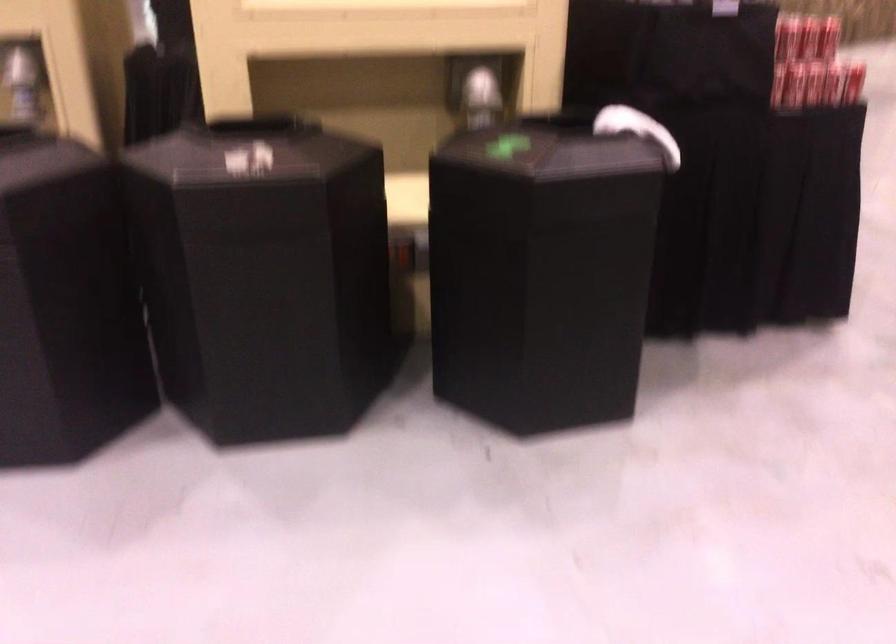
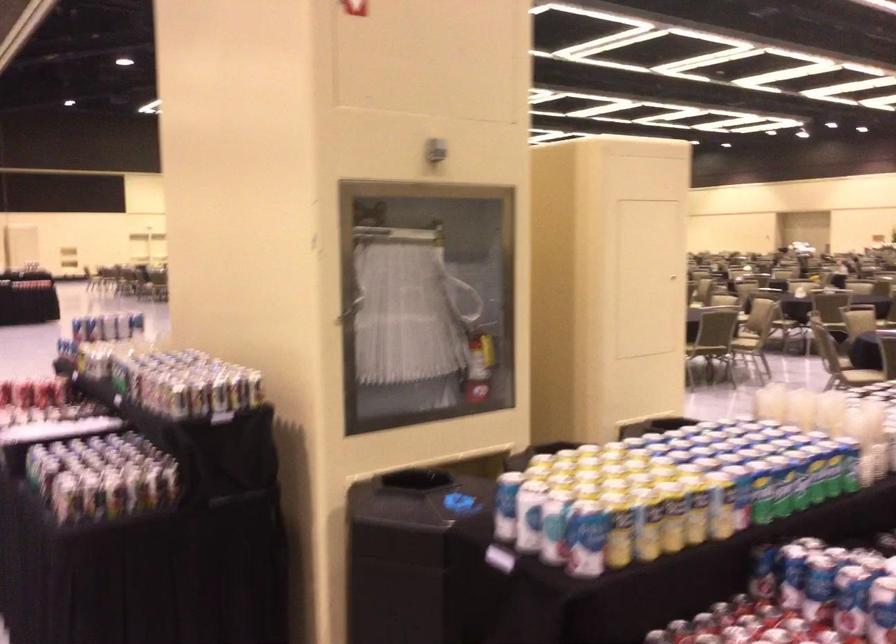
Question: I am providing you with two images of the same scene from different viewpoints. Which of the following objects are not visible in image2?

Choices:
 (A) light grey chair seat
 (B) red fire extinguisher
 (C) cabinet door handle
 (D) red soda can

Answer: (D)